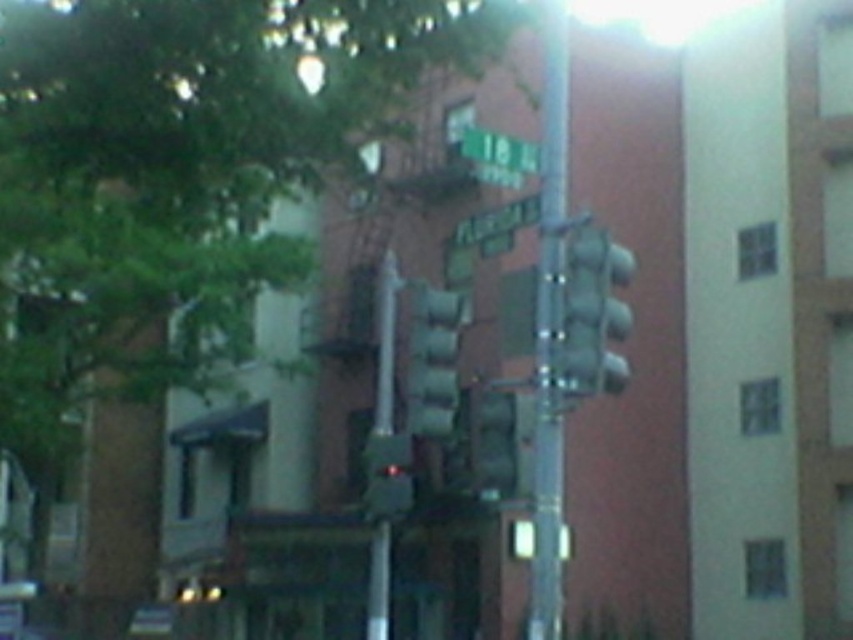
Question: Which point is farther from the camera taking this photo?

Choices:
 (A) (535, 307)
 (B) (380, 536)

Answer: (B)

Question: Does green leafy tree at upper left lie in front of green plastic street sign at upper center?

Choices:
 (A) yes
 (B) no

Answer: (A)

Question: Can you confirm if metallic gray traffic light at center is thinner than metallic pole at center?

Choices:
 (A) yes
 (B) no

Answer: (A)

Question: Among these points, which one is nearest to the camera?

Choices:
 (A) (479, 221)
 (B) (386, 348)
 (C) (596, 360)

Answer: (C)

Question: Which point is farther to the camera?

Choices:
 (A) (434, 323)
 (B) (550, 460)
 (C) (573, 237)
 (D) (480, 156)

Answer: (A)

Question: Is metallic gray traffic light at center smaller than green matte street sign at upper center?

Choices:
 (A) yes
 (B) no

Answer: (A)